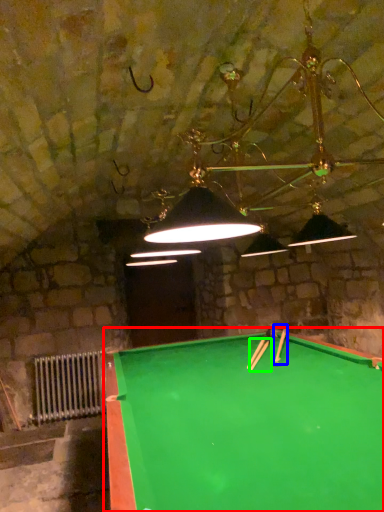
Question: Estimate the real-world distances between objects in this image. Which object is closer to billiard table (highlighted by a red box), cue (highlighted by a blue box) or cue (highlighted by a green box)?

Choices:
 (A) cue
 (B) cue

Answer: (B)